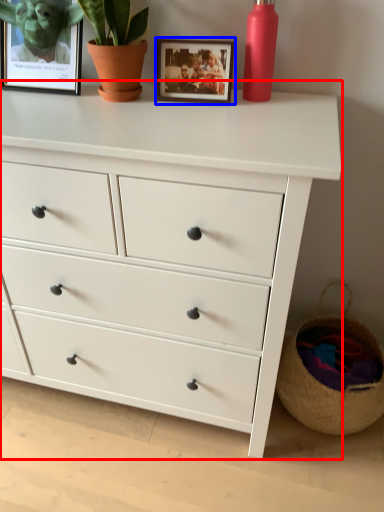
Question: Which of the following is the farthest to the observer, chest of drawers (highlighted by a red box) or picture frame (highlighted by a blue box)?

Choices:
 (A) chest of drawers
 (B) picture frame

Answer: (B)